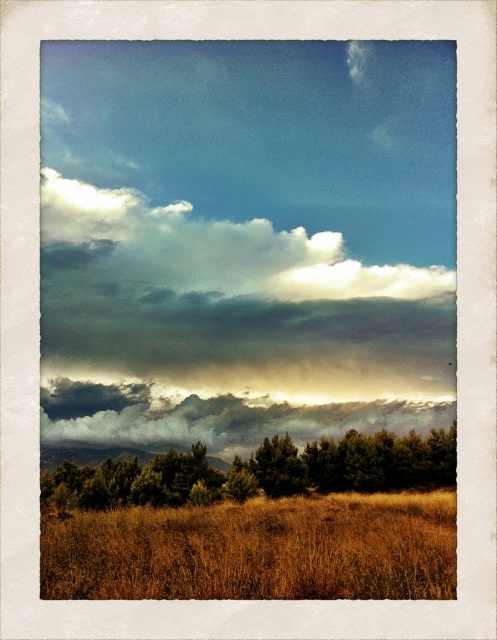
You are a drone operator who needs to fly your drone from the brown dry grass at lower center to the cloudy textured sky at center. What is the minimum vertical distance you need to ascend?

The minimum vertical distance you need to ascend is 9.53 meters to reach the cloudy textured sky at center from the brown dry grass at lower center.

You are standing in the field of golden grass and want to walk towards the horizon. Which direction should you head to avoid the green textured trees at lower center?

To avoid the green textured trees at lower center located at point (259, 472), you should walk towards the horizon in a direction away from that point, such as to the left or right of the trees.

Consider the image. You are a landscape painter planning to paint the scene. You have a canvas where the brown dry grass at lower center and cloudy textured sky at center must be depicted. Which object should you paint first if you want to follow the rule of painting smaller areas first?

The brown dry grass at lower center has a lesser width compared to cloudy textured sky at center, so you should paint the brown dry grass at lower center first as it is the smaller area.